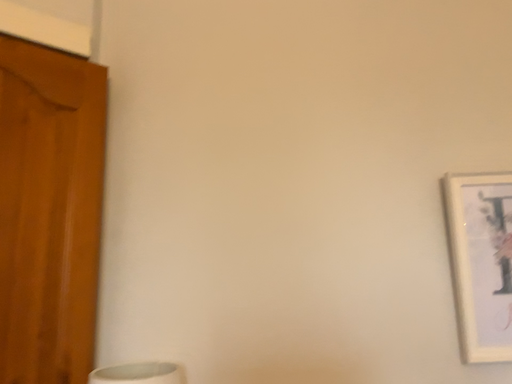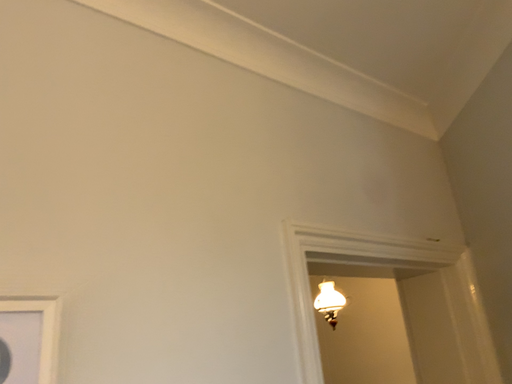
Question: Which way did the camera rotate in the video?

Choices:
 (A) rotated upward
 (B) rotated downward

Answer: (A)